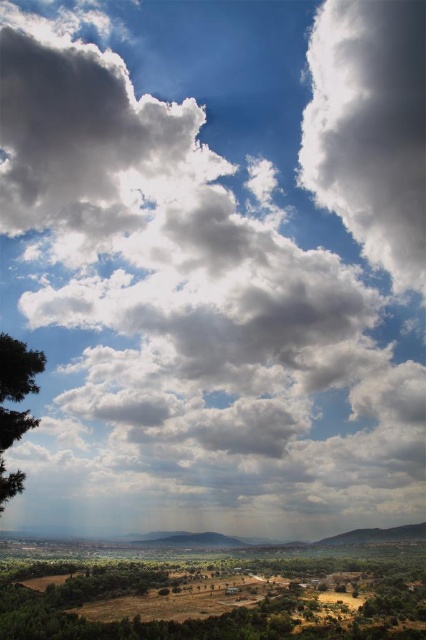
Question: Does brown textured tree at lower left have a greater width compared to white fluffy cloud at upper right?

Choices:
 (A) yes
 (B) no

Answer: (A)

Question: Which point is farther to the camera?

Choices:
 (A) green matte tree at left
 (B) white fluffy cloud at upper right

Answer: (B)

Question: Does white fluffy cloud at upper right have a smaller size compared to green leafy tree at lower center?

Choices:
 (A) yes
 (B) no

Answer: (B)

Question: From the image, what is the correct spatial relationship of brown textured tree at lower left in relation to green matte tree at left?

Choices:
 (A) right
 (B) left

Answer: (A)

Question: Which point appears closest to the camera in this image?

Choices:
 (A) (123, 573)
 (B) (305, 131)
 (C) (43, 362)

Answer: (C)

Question: Which of the following is the farthest from the observer?

Choices:
 (A) tap(198, 614)
 (B) tap(20, 483)

Answer: (A)